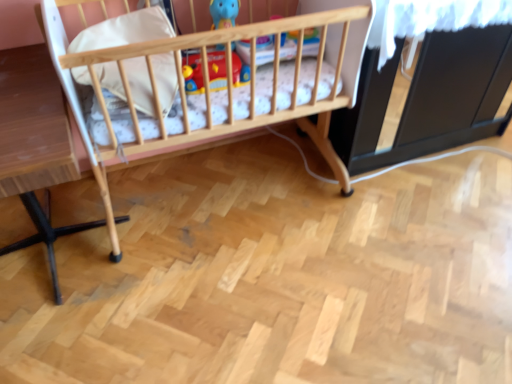
The height and width of the screenshot is (384, 512). I want to click on free space on the front side of wooden crib at center, so click(230, 304).